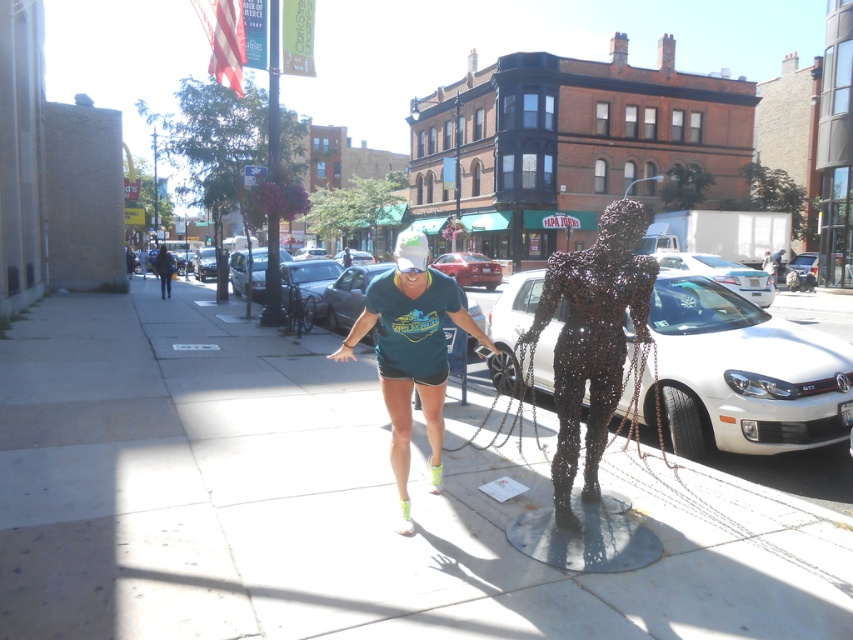
Which is in front, point (738, 365) or point (741, 284)?

Point (738, 365) is more forward.

What do you see at coordinates (743, 372) in the screenshot? I see `white metallic car at center` at bounding box center [743, 372].

Between point (508, 282) and point (733, 262), which one is positioned in front?

Point (733, 262) is more forward.

I want to click on white metallic car at center, so click(x=743, y=372).

Is gray concrete sidewalk at center taller than white metallic car at center?

Indeed, gray concrete sidewalk at center has a greater height compared to white metallic car at center.

Can you confirm if gray concrete sidewalk at center is bigger than white metallic car at center?

Yes, gray concrete sidewalk at center is bigger than white metallic car at center.

Is point (602, 593) positioned after point (532, 284)?

No.

Locate an element on the screen. gray concrete sidewalk at center is located at coordinates (328, 502).

Is point (776, 502) less distant than point (724, 284)?

Yes, point (776, 502) is in front of point (724, 284).

Who is more forward, (361, 477) or (695, 253)?

Point (361, 477)

Find the location of a particular element. gray concrete sidewalk at center is located at coordinates (328, 502).

The height and width of the screenshot is (640, 853). Identify the location of gray concrete sidewalk at center. (328, 502).